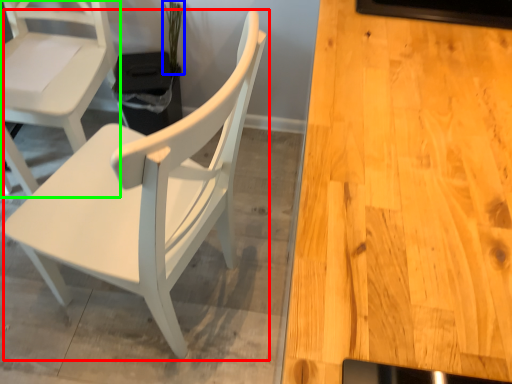
Question: Which is farther away from chair (highlighted by a red box)? plant (highlighted by a blue box) or chair (highlighted by a green box)?

Choices:
 (A) plant
 (B) chair

Answer: (A)